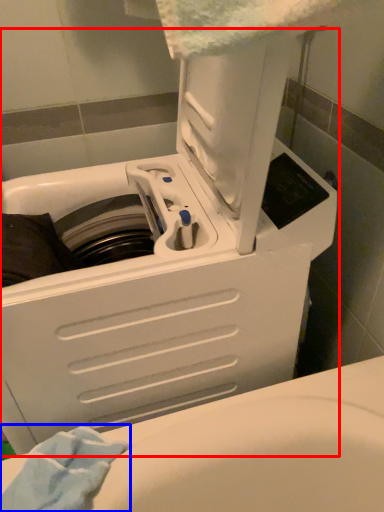
Question: Which of the following is the farthest to the observer, washing machine (highlighted by a red box) or bath towel (highlighted by a blue box)?

Choices:
 (A) washing machine
 (B) bath towel

Answer: (B)